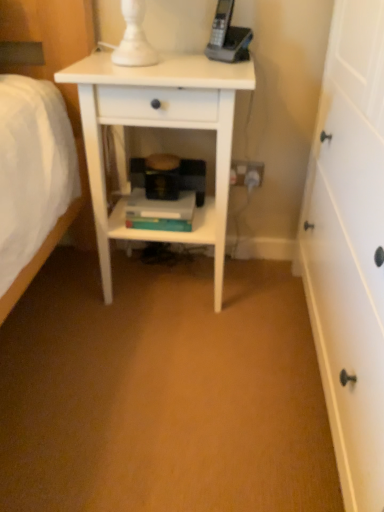
Question: Is white plastic electrical outlet at lower center at the right side of hardcover books at center?

Choices:
 (A) yes
 (B) no

Answer: (A)

Question: Is there a large distance between white plastic electrical outlet at lower center and hardcover books at center?

Choices:
 (A) yes
 (B) no

Answer: (B)

Question: Is white plastic electrical outlet at lower center smaller than hardcover books at center?

Choices:
 (A) yes
 (B) no

Answer: (A)

Question: From the image's perspective, does white plastic electrical outlet at lower center appear lower than hardcover books at center?

Choices:
 (A) yes
 (B) no

Answer: (B)

Question: Does white plastic electrical outlet at lower center have a greater height compared to hardcover books at center?

Choices:
 (A) no
 (B) yes

Answer: (B)

Question: Considering the positions of white plastic electrical outlet at lower center and hardcover books at center in the image, is white plastic electrical outlet at lower center wider or thinner than hardcover books at center?

Choices:
 (A) thin
 (B) wide

Answer: (A)

Question: From the image's perspective, is white plastic electrical outlet at lower center positioned above or below hardcover books at center?

Choices:
 (A) below
 (B) above

Answer: (B)

Question: Would you say white plastic electrical outlet at lower center is inside or outside hardcover books at center?

Choices:
 (A) inside
 (B) outside

Answer: (B)

Question: Relative to hardcover books at center, is white plastic electrical outlet at lower center in front or behind?

Choices:
 (A) front
 (B) behind

Answer: (B)

Question: Looking at the image, does white matte nightstand at center seem bigger or smaller compared to white plastic electrical outlet at lower center?

Choices:
 (A) small
 (B) big

Answer: (B)

Question: From a real-world perspective, is white matte nightstand at center positioned above or below white plastic electrical outlet at lower center?

Choices:
 (A) below
 (B) above

Answer: (B)

Question: Relative to white plastic electrical outlet at lower center, is white matte nightstand at center in front or behind?

Choices:
 (A) front
 (B) behind

Answer: (A)

Question: Does point (105, 74) appear closer or farther from the camera than point (233, 160)?

Choices:
 (A) closer
 (B) farther

Answer: (A)

Question: Choose the correct answer: Is hardcover books at center inside white plastic electrical outlet at lower center or outside it?

Choices:
 (A) inside
 (B) outside

Answer: (B)

Question: Relative to white plastic electrical outlet at lower center, is hardcover books at center in front or behind?

Choices:
 (A) front
 (B) behind

Answer: (A)